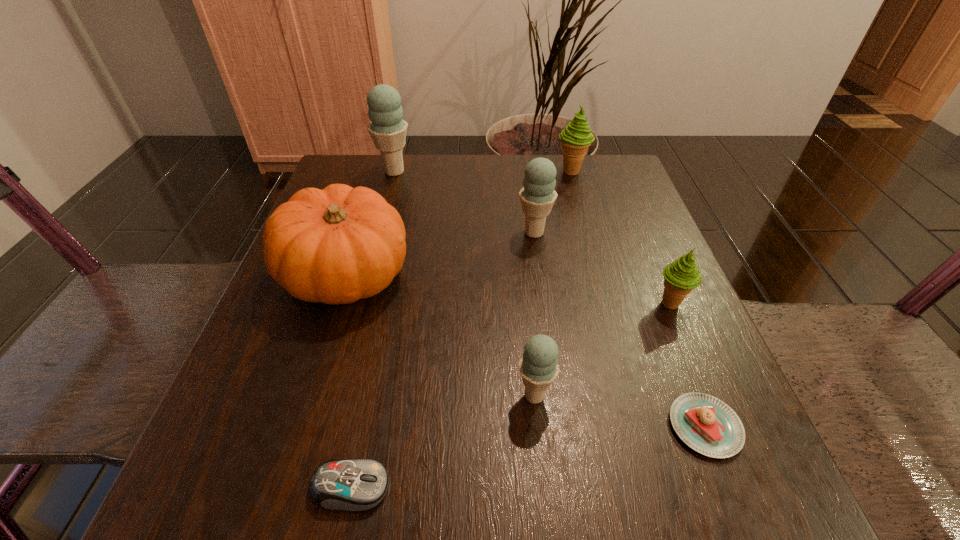
The image size is (960, 540). In order to click on vacant space positioned 0.090m on the wheel side of the seventh tallest object in this screenshot , I will do `click(461, 487)`.

I want to click on free point located on the back of the pastry, so [x=646, y=276].

At what (x,y) coordinates should I click in order to perform the action: click on computer mouse at the near edge. Please return your answer as a coordinate pair (x, y). The width and height of the screenshot is (960, 540). Looking at the image, I should click on (354, 485).

This screenshot has height=540, width=960. Identify the location of pastry present at the near edge. (706, 424).

Where is `ice cream that is at the left edge`? The height and width of the screenshot is (540, 960). ice cream that is at the left edge is located at coordinates (388, 130).

At what (x,y) coordinates should I click in order to perform the action: click on pumpkin present at the left edge. Please return your answer as a coordinate pair (x, y). The width and height of the screenshot is (960, 540). Looking at the image, I should click on 337,245.

I want to click on computer mouse that is at the left edge, so click(x=354, y=485).

Identify the location of pastry situated at the right edge. Image resolution: width=960 pixels, height=540 pixels. (706, 424).

Where is `object that is at the far left corner`? This screenshot has width=960, height=540. object that is at the far left corner is located at coordinates (388, 130).

Where is `object that is at the near left corner`? object that is at the near left corner is located at coordinates (354, 485).